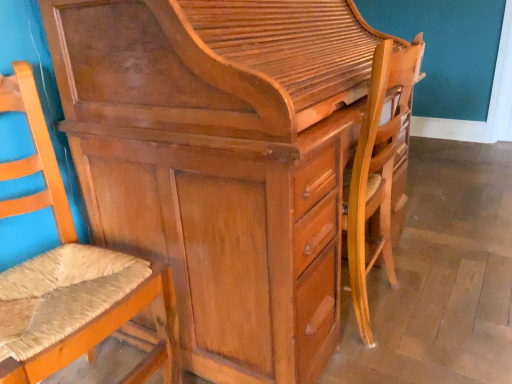
What do you see at coordinates (69, 275) in the screenshot?
I see `wooden woven seat at left` at bounding box center [69, 275].

The height and width of the screenshot is (384, 512). In order to click on wooden woven seat at left in this screenshot , I will do `click(69, 275)`.

In order to click on wooden woven seat at left in this screenshot , I will do `click(69, 275)`.